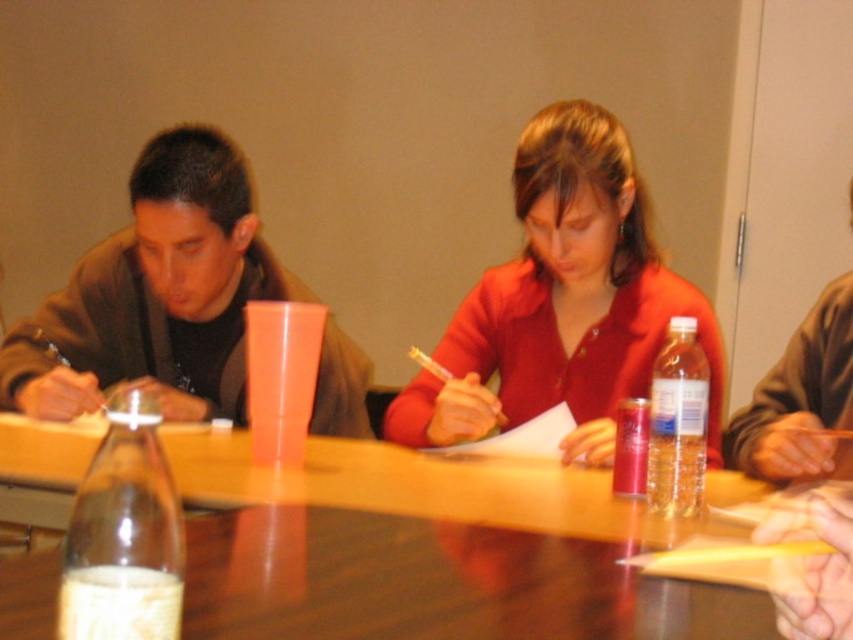
Can you confirm if matte red shirt at center is taller than wooden table at center?

Yes.

Is matte red shirt at center below wooden table at center?

No.

Between point (550, 298) and point (242, 496), which one is positioned in front?

Positioned in front is point (242, 496).

The width and height of the screenshot is (853, 640). Find the location of `matte red shirt at center`. matte red shirt at center is located at coordinates (563, 301).

Between matte red shirt at center and translucent plastic water bottle at table right, which one has less height?

translucent plastic water bottle at table right is shorter.

Consider the image. Who is more forward, (631, 394) or (656, 472)?

Positioned in front is point (656, 472).

Identify the location of matte red shirt at center. (563, 301).

Which of these two, clear plastic bottle at lower left or translucent plastic water bottle at table right, stands taller?

With more height is translucent plastic water bottle at table right.

Identify the location of clear plastic bottle at lower left. This screenshot has height=640, width=853. (125, 534).

Image resolution: width=853 pixels, height=640 pixels. What are the coordinates of `clear plastic bottle at lower left` in the screenshot? It's located at (125, 534).